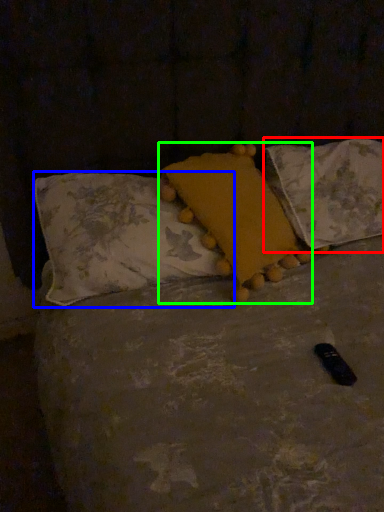
Question: Estimate the real-world distances between objects in this image. Which object is farther from pillow (highlighted by a red box), pillow (highlighted by a blue box) or pillow (highlighted by a green box)?

Choices:
 (A) pillow
 (B) pillow

Answer: (A)